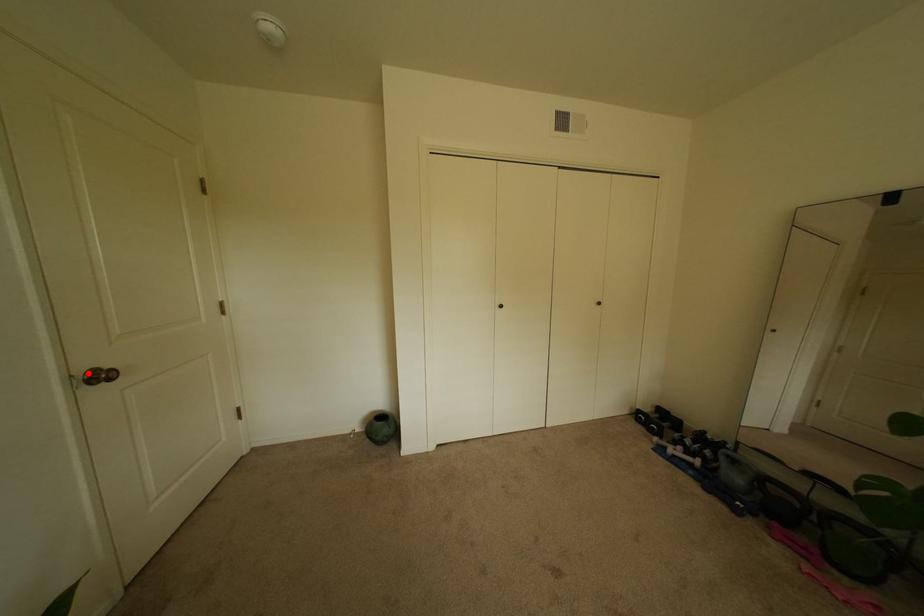
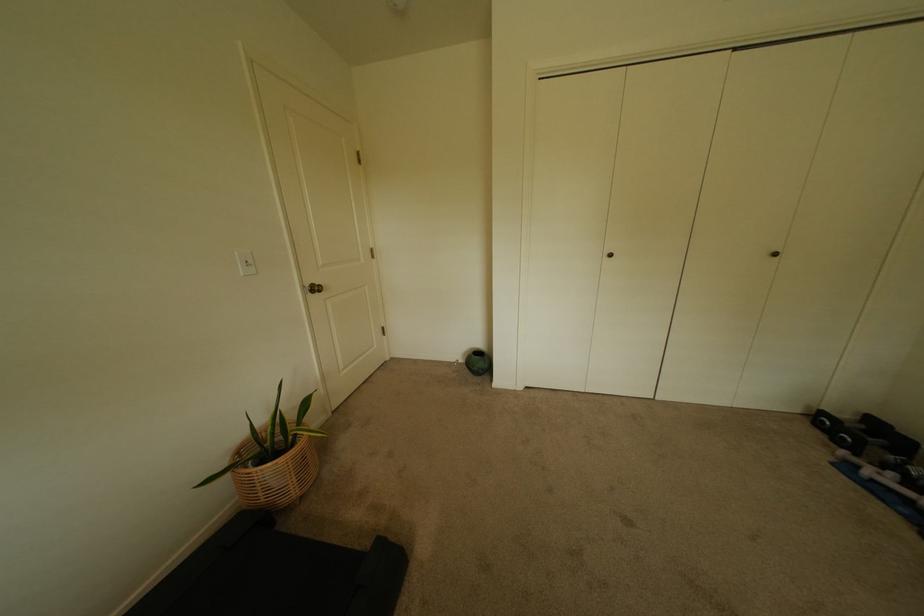
In the second image, find the point that corresponds to the highlighted location in the first image.

(315, 286)